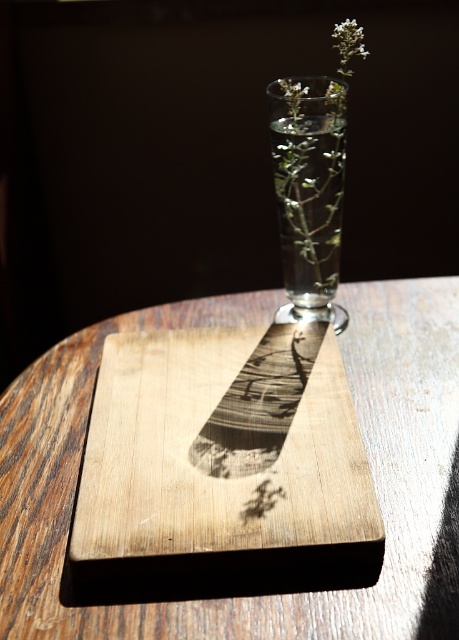
From the picture: You are arranging flowers in a clear glass vase at center and placing a white matte flower at upper center on top of it. Will the flower fit inside the vase?

The clear glass vase at center has a greater height compared to white matte flower at upper center, so the flower will fit inside the vase since the vase is taller than the flower.